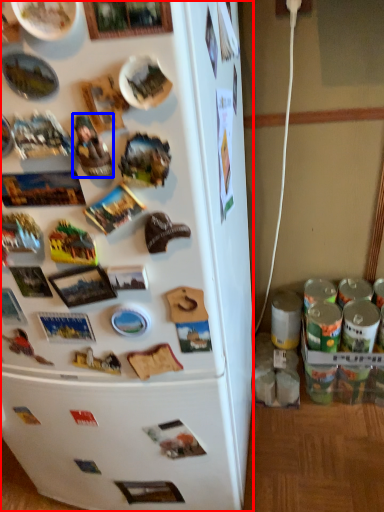
Question: Among these objects, which one is farthest to the camera, refrigerator (highlighted by a red box) or toy (highlighted by a blue box)?

Choices:
 (A) refrigerator
 (B) toy

Answer: (B)